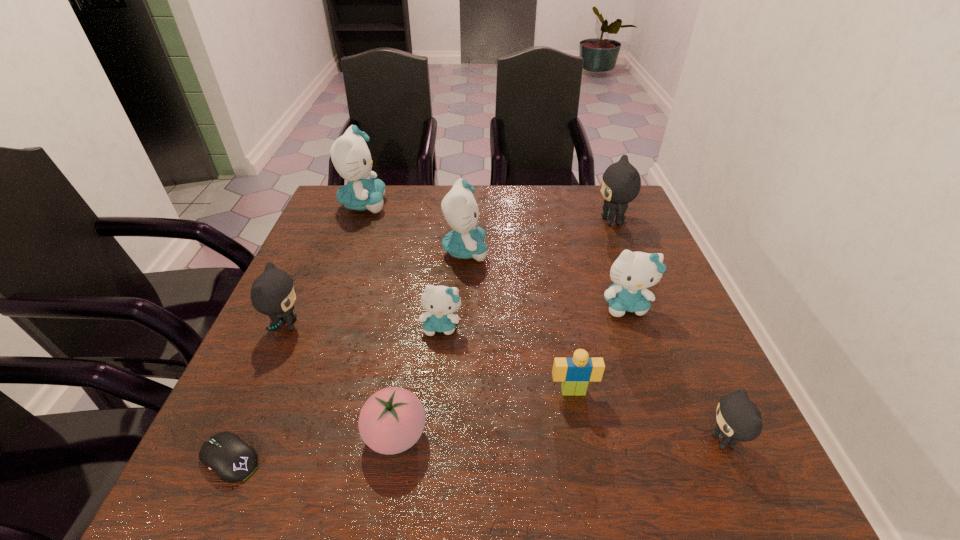
Where is `free region at the right edge of the desktop`? This screenshot has height=540, width=960. free region at the right edge of the desktop is located at coordinates (686, 429).

What are the coordinates of `vacant space at the near left corner of the desktop` in the screenshot? It's located at (268, 456).

This screenshot has width=960, height=540. I want to click on vacant space at the far right corner, so click(638, 210).

At what (x,y) coordinates should I click in order to perform the action: click on empty space that is in between the tomato and the farthest gray kitten. Please return your answer as a coordinate pair (x, y). Looking at the image, I should click on (504, 328).

Locate an element on the screen. free space between the second biggest blue kitten and the beige Lego is located at coordinates (519, 321).

Identify the location of free space between the tallest kitten and the farthest gray kitten. (488, 213).

The height and width of the screenshot is (540, 960). I want to click on vacant area that lies between the second biggest gray kitten and the third smallest blue kitten, so click(x=375, y=288).

Locate an element on the screen. The width and height of the screenshot is (960, 540). free spot between the black computer equipment and the farthest gray kitten is located at coordinates (421, 340).

What are the coordinates of `vacant space in between the computer equipment and the second farthest blue kitten` in the screenshot? It's located at (348, 355).

Locate an element on the screen. vacant region between the rightmost blue kitten and the smallest blue kitten is located at coordinates (534, 316).